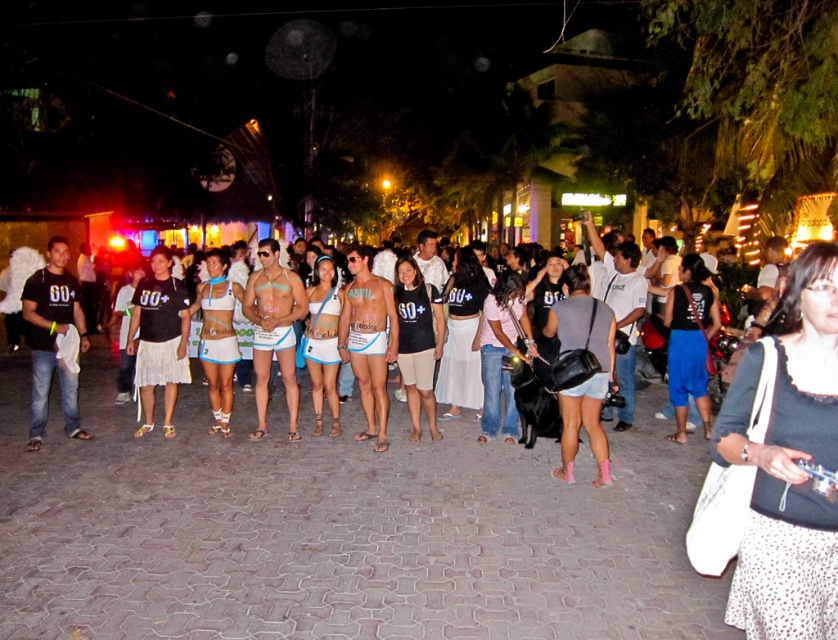
From the picture: Which is more to the left, white dotted fabric at lower right or pink fabric shirt at center?

Positioned to the left is pink fabric shirt at center.

Identify the location of white dotted fabric at lower right. This screenshot has width=838, height=640. (784, 580).

The width and height of the screenshot is (838, 640). Describe the element at coordinates (784, 580) in the screenshot. I see `white dotted fabric at lower right` at that location.

Locate an element on the screen. The image size is (838, 640). white dotted fabric at lower right is located at coordinates (784, 580).

Is black matte tank top at center-right to the right of white fabric bikini at center from the viewer's perspective?

Indeed, black matte tank top at center-right is positioned on the right side of white fabric bikini at center.

Between black matte tank top at center-right and white fabric bikini at center, which one has more height?

black matte tank top at center-right is taller.

Where is `black matte tank top at center-right`? The width and height of the screenshot is (838, 640). black matte tank top at center-right is located at coordinates (689, 342).

Where is `black matte tank top at center-right`? black matte tank top at center-right is located at coordinates (689, 342).

Is point (738, 364) in front of point (229, 291)?

That is True.

Who is lower down, white dotted fabric at center or matte white bikini at center?

white dotted fabric at center is below.

Describe the element at coordinates (789, 464) in the screenshot. I see `white dotted fabric at center` at that location.

Locate an element on the screen. white dotted fabric at center is located at coordinates (789, 464).